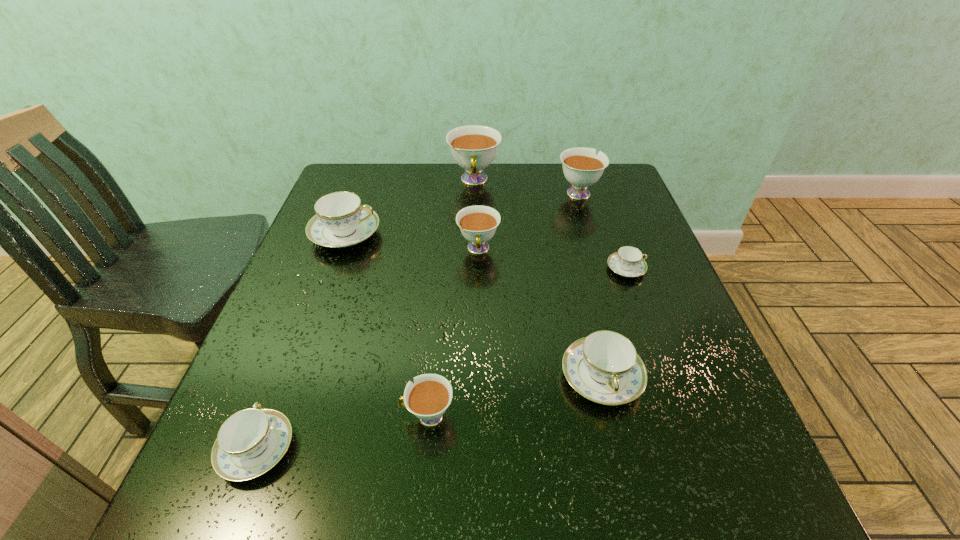
Image resolution: width=960 pixels, height=540 pixels. Identify the location of free space located 0.110m on the side with the handle of the nearest blue teacup. (290, 363).

Identify the location of object positioned at the near edge. Image resolution: width=960 pixels, height=540 pixels. (252, 441).

The height and width of the screenshot is (540, 960). What are the coordinates of `object located in the near left corner section of the desktop` in the screenshot? It's located at (252, 441).

Where is `object at the far right corner`? The image size is (960, 540). object at the far right corner is located at coordinates (582, 168).

This screenshot has height=540, width=960. In the image, there is a desktop. Find the location of `blank space at the far edge`. blank space at the far edge is located at coordinates (402, 167).

The width and height of the screenshot is (960, 540). Identify the location of vacant space at the near edge. (411, 490).

Locate an element on the screen. The image size is (960, 540). free region at the left edge of the desktop is located at coordinates (321, 421).

At what (x,y) coordinates should I click in order to perform the action: click on free point at the right edge. Please return your answer as a coordinate pair (x, y). Image resolution: width=960 pixels, height=540 pixels. Looking at the image, I should click on (673, 391).

In the image, there is a desktop. At what (x,y) coordinates should I click in order to perform the action: click on free region at the far left corner. Please return your answer as a coordinate pair (x, y). Looking at the image, I should click on (335, 178).

Locate an element on the screen. The width and height of the screenshot is (960, 540). free region at the near left corner is located at coordinates (228, 514).